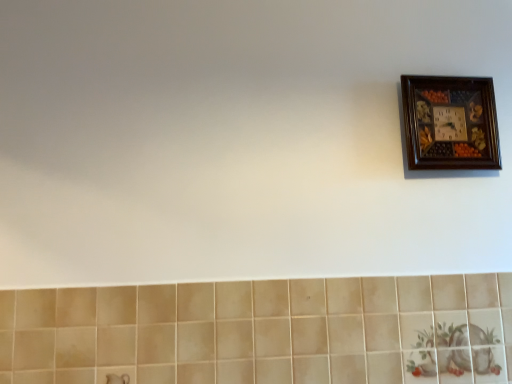
Question: Is wooden clock at upper right inside or outside of beige ceramic tile at lower center?

Choices:
 (A) inside
 (B) outside

Answer: (B)

Question: Would you say wooden clock at upper right is to the left or to the right of beige ceramic tile at lower center in the picture?

Choices:
 (A) left
 (B) right

Answer: (B)

Question: Considering their positions, is wooden clock at upper right located in front of or behind beige ceramic tile at lower center?

Choices:
 (A) front
 (B) behind

Answer: (B)

Question: In terms of size, does beige ceramic tile at lower center appear bigger or smaller than wooden clock at upper right?

Choices:
 (A) small
 (B) big

Answer: (B)

Question: From the image's perspective, is beige ceramic tile at lower center located above or below wooden clock at upper right?

Choices:
 (A) below
 (B) above

Answer: (A)

Question: Is beige ceramic tile at lower center wider or thinner than wooden clock at upper right?

Choices:
 (A) wide
 (B) thin

Answer: (B)

Question: Considering the positions of point (175, 345) and point (443, 86), is point (175, 345) closer or farther from the camera than point (443, 86)?

Choices:
 (A) farther
 (B) closer

Answer: (B)